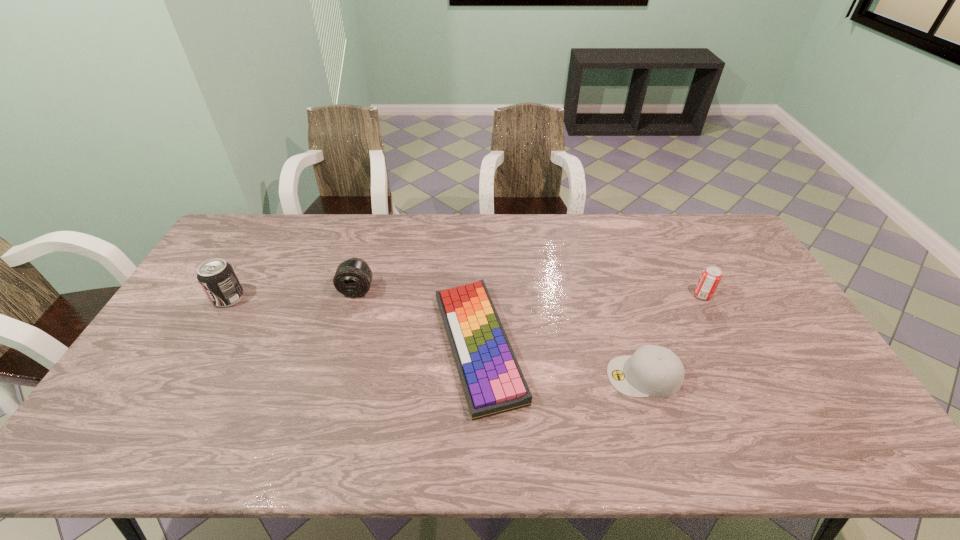
The width and height of the screenshot is (960, 540). Find the location of `unoccupied position between the telephoto lens and the computer keyboard`. unoccupied position between the telephoto lens and the computer keyboard is located at coordinates (418, 318).

Locate an element on the screen. The height and width of the screenshot is (540, 960). empty space that is in between the third object from left to right and the fourth object from right to left is located at coordinates (418, 318).

Locate an element on the screen. This screenshot has width=960, height=540. object that is the fourth nearest to the fourth object from right to left is located at coordinates (711, 275).

Find the location of `the third closest object to the third object from left to right`. the third closest object to the third object from left to right is located at coordinates (711, 275).

Identify the location of free space in the image that satisfies the following two spatial constraints: 1. on the front-facing side of the rightmost object; 2. on the right side of the telephoto lens. (355, 295).